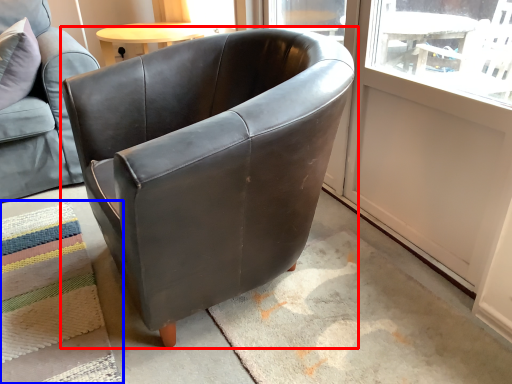
Question: Which of the following is the farthest to the observer, chair (highlighted by a red box) or mat (highlighted by a blue box)?

Choices:
 (A) chair
 (B) mat

Answer: (B)